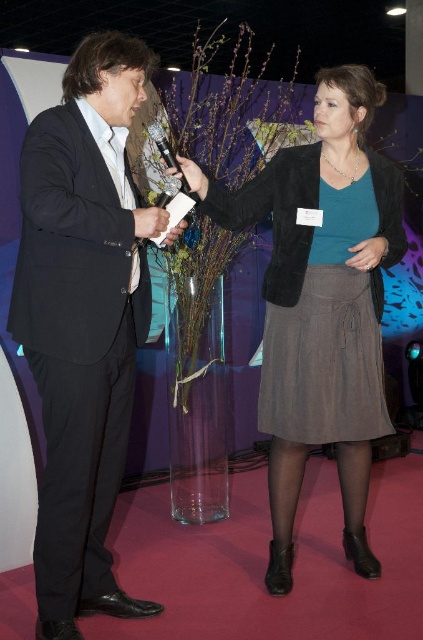
Question: Which is farther from the black matte suit at left?

Choices:
 (A) matte brown skirt at center
 (B) matte black hand at center
 (C) velvet black jacket at center

Answer: (A)

Question: Does black matte suit at left have a greater width compared to matte black hand at center?

Choices:
 (A) no
 (B) yes

Answer: (B)

Question: Can you confirm if velvet black jacket at center is positioned to the left of matte black hand at center?

Choices:
 (A) no
 (B) yes

Answer: (A)

Question: Observing the image, what is the correct spatial positioning of black matte suit at left in reference to matte brown skirt at center?

Choices:
 (A) left
 (B) right

Answer: (A)

Question: Which object appears closest to the camera in this image?

Choices:
 (A) matte brown skirt at center
 (B) matte black hand at center

Answer: (B)

Question: Which point is closer to the camera taking this photo?

Choices:
 (A) (308, 246)
 (B) (282, 172)
 (C) (158, 221)
 (D) (129, 390)

Answer: (C)